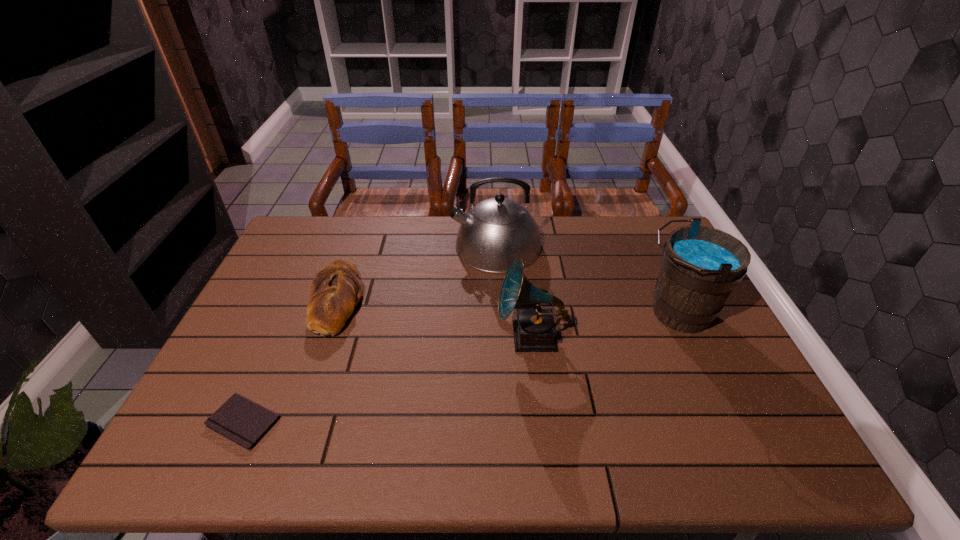
Identify the location of kettle. (495, 232).

This screenshot has height=540, width=960. Identify the location of wine bucket. (700, 266).

Locate an element on the screen. Image resolution: width=960 pixels, height=540 pixels. phonograph_record is located at coordinates (534, 330).

Identify the location of bread. This screenshot has height=540, width=960. (335, 291).

Where is `the shortest object`? the shortest object is located at coordinates click(x=244, y=422).

You are a GUI agent. You are given a task and a screenshot of the screen. Output one action in this format:
    pyautogui.click(x=<x>, y=<y>)
    Task: Click on the checkbook
    
    Given the screenshot: What is the action you would take?
    244,422

Locate an element on the screen. vacant space located from the spout of the kettle is located at coordinates (407, 246).

Locate an element on the screen. vacant space located from the spout of the kettle is located at coordinates click(336, 246).

What are the coordinates of `blank area located 0.150m from the spout of the kettle` in the screenshot? It's located at (407, 246).

Identify the location of vacant space located 0.190m with a handle on the side of the wine bucket. (569, 313).